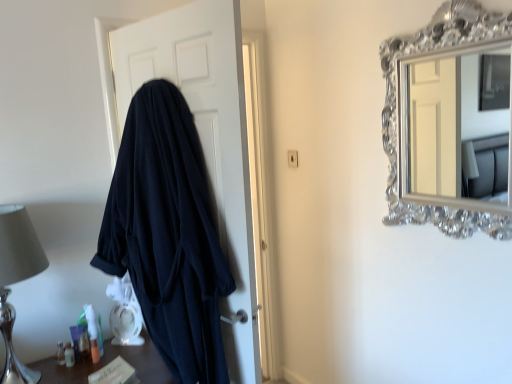
Describe the element at coordinates (206, 136) in the screenshot. This screenshot has width=512, height=384. I see `dark blue robe at left` at that location.

This screenshot has width=512, height=384. What do you see at coordinates (94, 350) in the screenshot?
I see `translucent plastic tube at lower left, positioned as the 1th toiletry in right-to-left order` at bounding box center [94, 350].

I want to click on translucent plastic toiletries at lower left, so click(106, 363).

Where is `dark blue robe at left`? Image resolution: width=512 pixels, height=384 pixels. dark blue robe at left is located at coordinates (206, 136).

Considering the sizes of silver metallic table lamp at left and translucent plastic tube at lower left, positioned as the 1th toiletry in right-to-left order, in the image, is silver metallic table lamp at left wider or thinner than translucent plastic tube at lower left, positioned as the 1th toiletry in right-to-left order,?

In the image, silver metallic table lamp at left appears to be wider than translucent plastic tube at lower left, positioned as the 1th toiletry in right-to-left order.

Does silver metallic table lamp at left appear on the left side of translucent plastic tube at lower left, positioned as the 1th toiletry in right-to-left order?

Indeed, silver metallic table lamp at left is positioned on the left side of translucent plastic tube at lower left, positioned as the 1th toiletry in right-to-left order.

From a real-world perspective, does silver metallic table lamp at left sit lower than translucent plastic tube at lower left, positioned as the 1th toiletry in right-to-left order?

No, from a real-world perspective, silver metallic table lamp at left is not below translucent plastic tube at lower left, positioned as the 1th toiletry in right-to-left order.

Would you say silver metallic table lamp at left contains translucent plastic tube at lower left, positioned as the 1th toiletry in right-to-left order?

No, translucent plastic tube at lower left, positioned as the 1th toiletry in right-to-left order, is not inside silver metallic table lamp at left.

Could you tell me if translucent plastic toiletries at lower left is turned towards translucent plastic container at lower left, the 2th toiletry positioned from the right?

No, translucent plastic toiletries at lower left is not oriented towards translucent plastic container at lower left, the 2th toiletry positioned from the right.

Locate an element on the screen. This screenshot has height=384, width=512. the 1st toiletry above when counting from the translucent plastic toiletries at lower left (from the image's perspective) is located at coordinates (69, 355).

Can you confirm if translucent plastic toiletries at lower left is smaller than translucent plastic container at lower left, the 2th toiletry positioned from the right?

Incorrect, translucent plastic toiletries at lower left is not smaller in size than translucent plastic container at lower left, the 2th toiletry positioned from the right.

Considering the relative positions of translucent plastic toiletries at lower left and dark blue robe at left in the image provided, is translucent plastic toiletries at lower left behind dark blue robe at left?

No, translucent plastic toiletries at lower left is closer to the camera.

From a real-world perspective, is translucent plastic toiletries at lower left beneath dark blue robe at left?

Yes, from a real-world perspective, translucent plastic toiletries at lower left is beneath dark blue robe at left.

Is translucent plastic toiletries at lower left outside of dark blue robe at left?

Yes, translucent plastic toiletries at lower left is not within dark blue robe at left.

Consider the image. Is dark blue robe at left at the back of translucent plastic toiletries at lower left?

No.

How many degrees apart are the facing directions of translucent plastic tube at lower left, positioned as the 1th toiletry in right-to-left order, and dark blue robe at left?

There is a 109-degree angle between the facing directions of translucent plastic tube at lower left, positioned as the 1th toiletry in right-to-left order, and dark blue robe at left.

From the image's perspective, is translucent plastic tube at lower left, positioned as the 1th toiletry in right-to-left order, above dark blue robe at left?

No.

In the scene shown: From a real-world perspective, is translucent plastic tube at lower left, positioned as the 1th toiletry in right-to-left order, beneath dark blue robe at left?

Yes, from a real-world perspective, translucent plastic tube at lower left, positioned as the 1th toiletry in right-to-left order, is beneath dark blue robe at left.

Measure the distance from translucent plastic tube at lower left, positioned as the 1th toiletry in right-to-left order, to dark blue robe at left.

The distance of translucent plastic tube at lower left, positioned as the 1th toiletry in right-to-left order, from dark blue robe at left is 1.03 meters.

Is translucent plastic container at lower left, the first toiletry from the left, inside the boundaries of translucent plastic tube at lower left, acting as the second toiletry starting from the left, or outside?

translucent plastic container at lower left, the first toiletry from the left, cannot be found inside translucent plastic tube at lower left, acting as the second toiletry starting from the left.

Considering the relative positions of translucent plastic container at lower left, the first toiletry from the left, and translucent plastic tube at lower left, positioned as the 1th toiletry in right-to-left order, in the image provided, is translucent plastic container at lower left, the first toiletry from the left, to the right of translucent plastic tube at lower left, positioned as the 1th toiletry in right-to-left order, from the viewer's perspective?

No.

Which of these two, translucent plastic container at lower left, the first toiletry from the left, or translucent plastic tube at lower left, acting as the second toiletry starting from the left, is wider?

translucent plastic container at lower left, the first toiletry from the left.

Which of these two, translucent plastic container at lower left, the first toiletry from the left, or translucent plastic tube at lower left, acting as the second toiletry starting from the left, stands taller?

With more height is translucent plastic tube at lower left, acting as the second toiletry starting from the left.

In the scene shown: From a real-world perspective, is dark blue robe at left above or below translucent plastic tube at lower left, acting as the second toiletry starting from the left?

Clearly, from a real-world perspective, dark blue robe at left is above translucent plastic tube at lower left, acting as the second toiletry starting from the left.

Considering the sizes of objects dark blue robe at left and translucent plastic tube at lower left, acting as the second toiletry starting from the left, in the image provided, who is smaller, dark blue robe at left or translucent plastic tube at lower left, acting as the second toiletry starting from the left,?

With smaller size is translucent plastic tube at lower left, acting as the second toiletry starting from the left.

Is dark blue robe at left not inside translucent plastic tube at lower left, acting as the second toiletry starting from the left?

Absolutely, dark blue robe at left is external to translucent plastic tube at lower left, acting as the second toiletry starting from the left.

In order to click on door on the right of translucent plastic tube at lower left, acting as the second toiletry starting from the left in this screenshot , I will do `click(206, 136)`.

How distant is dark blue robe at left from translucent plastic toiletries at lower left?

dark blue robe at left is 30.42 inches away from translucent plastic toiletries at lower left.

From the image's perspective, which is above, dark blue robe at left or translucent plastic toiletries at lower left?

dark blue robe at left, from the image's perspective.

Considering the relative sizes of dark blue robe at left and translucent plastic toiletries at lower left in the image provided, is dark blue robe at left bigger than translucent plastic toiletries at lower left?

Indeed, dark blue robe at left has a larger size compared to translucent plastic toiletries at lower left.

Is dark blue robe at left positioned in front of translucent plastic toiletries at lower left?

No, it is not.

Where is `table lamp lying above the translucent plastic tube at lower left, acting as the second toiletry starting from the left (from the image's perspective)`? The image size is (512, 384). table lamp lying above the translucent plastic tube at lower left, acting as the second toiletry starting from the left (from the image's perspective) is located at coordinates (16, 281).

What are the coordinates of `toiletry that is the 1st one when counting backward from the translucent plastic toiletries at lower left` in the screenshot? It's located at (69, 355).

Looking at the image, which one is located further to silver metallic table lamp at left, translucent plastic tube at lower left, positioned as the 1th toiletry in right-to-left order, or translucent plastic toiletries at lower left?

Among the two, translucent plastic toiletries at lower left is located further to silver metallic table lamp at left.

From the image, which object appears to be farther from dark blue robe at left, silver metallic table lamp at left or translucent plastic tube at lower left, positioned as the 1th toiletry in right-to-left order?

translucent plastic tube at lower left, positioned as the 1th toiletry in right-to-left order, is further to dark blue robe at left.

From the picture: Looking at the image, which one is located closer to translucent plastic toiletries at lower left, silver metallic table lamp at left or dark blue robe at left?

Among the two, silver metallic table lamp at left is located nearer to translucent plastic toiletries at lower left.

Estimate the real-world distances between objects in this image. Which object is closer to translucent plastic tube at lower left, acting as the second toiletry starting from the left, dark blue robe at left or translucent plastic toiletries at lower left?

translucent plastic toiletries at lower left.

Based on their spatial positions, is silver metallic table lamp at left or dark blue robe at left further from translucent plastic tube at lower left, positioned as the 1th toiletry in right-to-left order?

dark blue robe at left is further to translucent plastic tube at lower left, positioned as the 1th toiletry in right-to-left order.

Looking at the image, which one is located further to translucent plastic container at lower left, the 2th toiletry positioned from the right, translucent plastic toiletries at lower left or dark blue robe at left?

Among the two, dark blue robe at left is located further to translucent plastic container at lower left, the 2th toiletry positioned from the right.

When comparing their distances from translucent plastic tube at lower left, acting as the second toiletry starting from the left, does translucent plastic toiletries at lower left or translucent plastic container at lower left, the first toiletry from the left, seem closer?

translucent plastic container at lower left, the first toiletry from the left.

Estimate the real-world distances between objects in this image. Which object is further from translucent plastic toiletries at lower left, dark blue robe at left or translucent plastic container at lower left, the first toiletry from the left?

dark blue robe at left is further to translucent plastic toiletries at lower left.

Identify the location of toiletry located between silver metallic table lamp at left and translucent plastic tube at lower left, positioned as the 1th toiletry in right-to-left order, in the depth direction. (69, 355).

Find the location of `toiletry positioned between translucent plastic toiletries at lower left and translucent plastic tube at lower left, acting as the second toiletry starting from the left, from near to far`. toiletry positioned between translucent plastic toiletries at lower left and translucent plastic tube at lower left, acting as the second toiletry starting from the left, from near to far is located at coordinates (69, 355).

Locate an element on the screen. toiletry between dark blue robe at left and translucent plastic container at lower left, the first toiletry from the left, vertically is located at coordinates point(94,350).

Locate an element on the screen. This screenshot has width=512, height=384. table lamp between dark blue robe at left and translucent plastic toiletries at lower left from top to bottom is located at coordinates (16, 281).